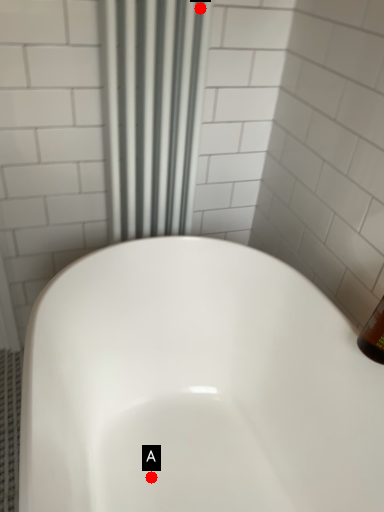
Question: Two points are circled on the image, labeled by A and B beside each circle. Which point is closer to the camera?

Choices:
 (A) A is closer
 (B) B is closer

Answer: (B)